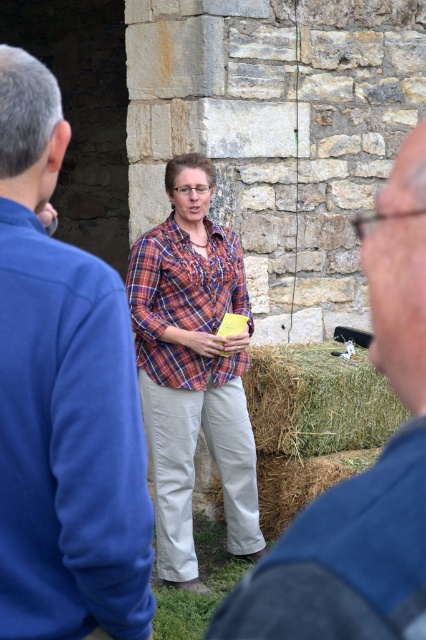
Is blue fabric shirt at center smaller than straw bale at center?

Indeed, blue fabric shirt at center has a smaller size compared to straw bale at center.

Is the position of blue fabric shirt at center less distant than that of straw bale at center?

Yes, it is in front of straw bale at center.

Which is in front, point (362, 490) or point (271, 531)?

Positioned in front is point (362, 490).

Where is `blue fabric shirt at center`? blue fabric shirt at center is located at coordinates (365, 472).

Can you confirm if blue fleece jacket at center is wider than straw bale at center?

No, blue fleece jacket at center is not wider than straw bale at center.

The width and height of the screenshot is (426, 640). Find the location of `blue fleece jacket at center`. blue fleece jacket at center is located at coordinates (63, 401).

Is blue fleece jacket at center to the right of blue fabric shirt at center from the viewer's perspective?

In fact, blue fleece jacket at center is to the left of blue fabric shirt at center.

Can you confirm if blue fleece jacket at center is positioned above blue fabric shirt at center?

Answer: Indeed, blue fleece jacket at center is positioned over blue fabric shirt at center.

Is point (94, 332) positioned in front of point (305, 600)?

No, (94, 332) is behind (305, 600).

I want to click on blue fleece jacket at center, so click(x=63, y=401).